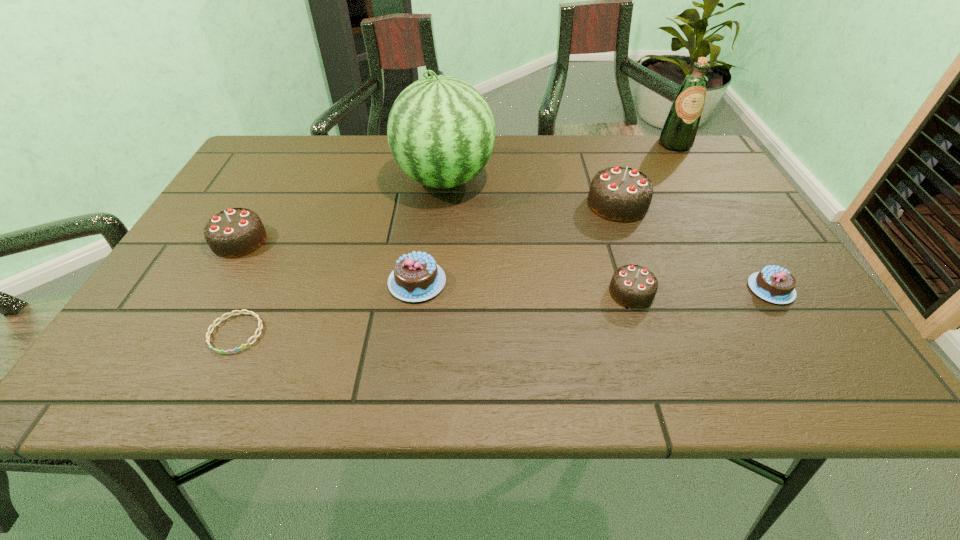
The height and width of the screenshot is (540, 960). What are the coordinates of `object present at the near left corner` in the screenshot? It's located at (213, 325).

This screenshot has width=960, height=540. In order to click on object that is positioned at the far right corner in this screenshot , I will do `click(678, 134)`.

Locate an element on the screen. blank space at the far edge is located at coordinates (654, 165).

In order to click on free region at the near edge in this screenshot , I will do `click(538, 383)`.

Where is `free space at the left edge of the desktop`? This screenshot has height=540, width=960. free space at the left edge of the desktop is located at coordinates (245, 273).

The height and width of the screenshot is (540, 960). In the image, there is a desktop. What are the coordinates of `vacant area at the right edge` in the screenshot? It's located at (804, 339).

This screenshot has height=540, width=960. I want to click on free location at the far right corner of the desktop, so click(x=654, y=134).

What are the coordinates of `vacant region at the near right corner of the desktop` in the screenshot? It's located at (833, 358).

The image size is (960, 540). Find the location of `free space between the tallest chocolate cake and the smaller pink chocolate cake`. free space between the tallest chocolate cake and the smaller pink chocolate cake is located at coordinates (694, 246).

Locate an element on the screen. free space that is in between the farthest chocolate cake and the fourth chocolate cake from right to left is located at coordinates (517, 243).